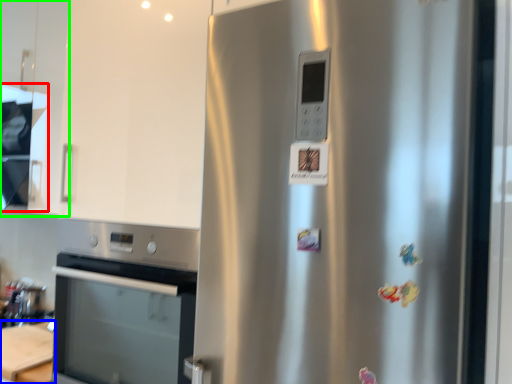
Question: Which object is the closest to the exhaust hood (highlighted by a red box)? Choose among these: table (highlighted by a blue box) or cabinetry (highlighted by a green box).

Choices:
 (A) table
 (B) cabinetry

Answer: (B)